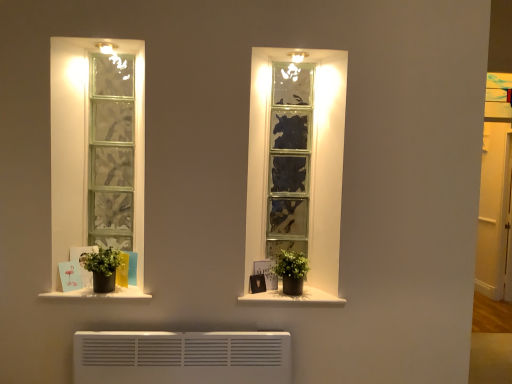
Question: Can you confirm if white matte window sill at lower left, which ranks as the 2th window sill in right-to-left order, is positioned to the right of white matte window sill at center, acting as the 2th window sill starting from the left?

Choices:
 (A) no
 (B) yes

Answer: (A)

Question: Would you say white matte window sill at lower left, the 1th window sill in the left-to-right sequence, is a long distance from white matte window sill at center, acting as the 2th window sill starting from the left?

Choices:
 (A) yes
 (B) no

Answer: (B)

Question: Is white matte window sill at lower left, which ranks as the 2th window sill in right-to-left order, in front of white matte window sill at center, acting as the 2th window sill starting from the left?

Choices:
 (A) yes
 (B) no

Answer: (A)

Question: Does white matte window sill at lower left, which ranks as the 2th window sill in right-to-left order, have a larger size compared to white matte window sill at center, acting as the 2th window sill starting from the left?

Choices:
 (A) no
 (B) yes

Answer: (B)

Question: Can you confirm if white matte window sill at lower left, which ranks as the 2th window sill in right-to-left order, is shorter than white matte window sill at center, acting as the 2th window sill starting from the left?

Choices:
 (A) yes
 (B) no

Answer: (B)

Question: From a real-world perspective, is green matte pot at left, which ranks as the 2th houseplant in right-to-left order, positioned above or below transparent glass door at right?

Choices:
 (A) above
 (B) below

Answer: (B)

Question: In terms of size, does green matte pot at left, which ranks as the 2th houseplant in right-to-left order, appear bigger or smaller than transparent glass door at right?

Choices:
 (A) small
 (B) big

Answer: (A)

Question: Does point (123, 284) appear closer or farther from the camera than point (499, 261)?

Choices:
 (A) farther
 (B) closer

Answer: (B)

Question: In terms of width, does green matte pot at left, which ranks as the 2th houseplant in right-to-left order, look wider or thinner when compared to transparent glass door at right?

Choices:
 (A) thin
 (B) wide

Answer: (B)

Question: In terms of height, does green matte plant at right, which appears as the second houseplant when viewed from the left, look taller or shorter compared to white matte window sill at lower left, the 1th window sill in the left-to-right sequence?

Choices:
 (A) short
 (B) tall

Answer: (B)

Question: Would you say green matte plant at right, which is the first houseplant from right to left, is inside or outside white matte window sill at lower left, the 1th window sill in the left-to-right sequence?

Choices:
 (A) inside
 (B) outside

Answer: (B)

Question: In terms of width, does green matte plant at right, which is the first houseplant from right to left, look wider or thinner when compared to white matte window sill at lower left, the 1th window sill in the left-to-right sequence?

Choices:
 (A) thin
 (B) wide

Answer: (A)

Question: Is green matte plant at right, which is the first houseplant from right to left, bigger or smaller than white matte window sill at lower left, the 1th window sill in the left-to-right sequence?

Choices:
 (A) big
 (B) small

Answer: (A)

Question: Visually, is matte black picture frame at center positioned to the left or to the right of green matte plant at right, which appears as the second houseplant when viewed from the left?

Choices:
 (A) left
 (B) right

Answer: (A)

Question: Is point (261, 286) closer or farther from the camera than point (283, 284)?

Choices:
 (A) closer
 (B) farther

Answer: (B)